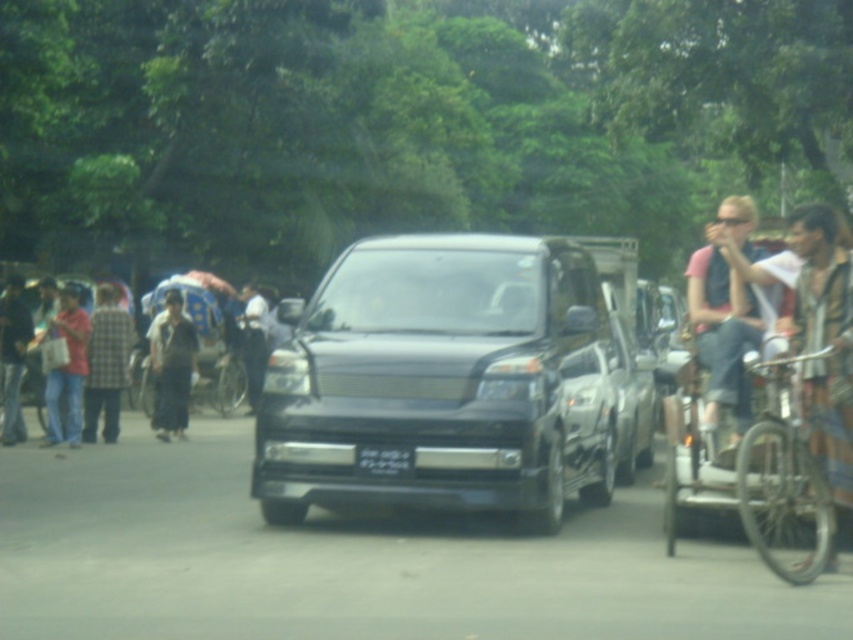
The width and height of the screenshot is (853, 640). Describe the element at coordinates (721, 337) in the screenshot. I see `denim jeans at right` at that location.

In order to click on denim jeans at right in this screenshot , I will do `click(721, 337)`.

This screenshot has height=640, width=853. Find the location of `denim jeans at right`. denim jeans at right is located at coordinates (721, 337).

Who is more forward, (264, 444) or (202, 362)?

Point (264, 444) is more forward.

Looking at this image, who is lower down, shiny black suv at center or metallic silver bicycle at center?

metallic silver bicycle at center is lower down.

Is point (444, 378) farther from camera compared to point (202, 360)?

That is False.

Where is `shiny black suv at center`? This screenshot has height=640, width=853. shiny black suv at center is located at coordinates (444, 380).

Is plaid fabric shirt at left thinner than dark blue jeans at left?

Incorrect, plaid fabric shirt at left's width is not less than dark blue jeans at left's.

Is point (119, 387) less distant than point (15, 392)?

No, (119, 387) is behind (15, 392).

Identify the location of plaid fabric shirt at left. (106, 362).